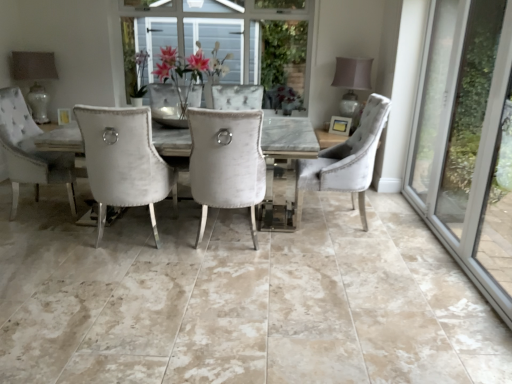
The width and height of the screenshot is (512, 384). I want to click on free location in front of velvet grey chair at right, which ranks as the first chair in right-to-left order, so click(359, 251).